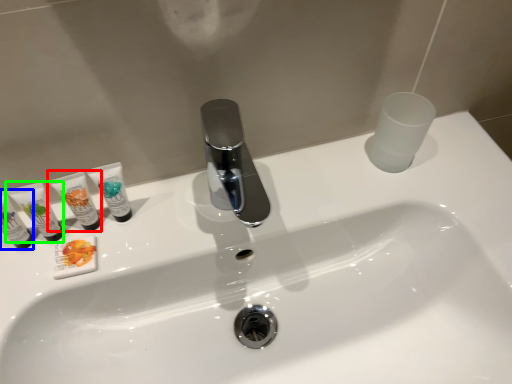
Question: Based on their relative distances, which object is nearer to toiletry (highlighted by a red box)? Choose from toiletry (highlighted by a blue box) and toiletry (highlighted by a green box).

Choices:
 (A) toiletry
 (B) toiletry

Answer: (B)